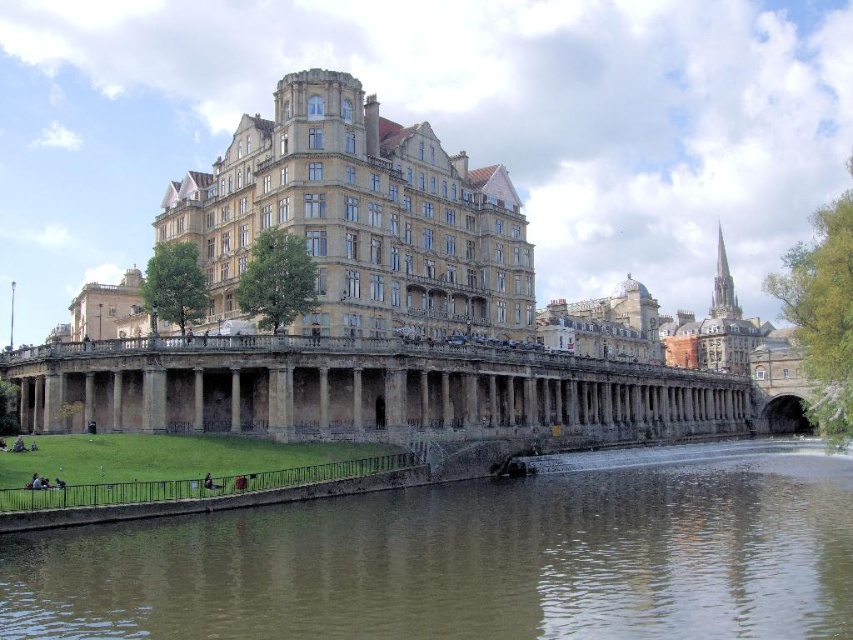
Question: Which of the following is the farthest from the observer?

Choices:
 (A) (244, 561)
 (B) (91, 344)

Answer: (B)

Question: Is brown murky water at lower center below stone columned bridge at center?

Choices:
 (A) no
 (B) yes

Answer: (B)

Question: Does brown murky water at lower center appear on the right side of stone columned bridge at center?

Choices:
 (A) yes
 (B) no

Answer: (A)

Question: Among these objects, which one is nearest to the camera?

Choices:
 (A) brown murky water at lower center
 (B) stone columned bridge at center

Answer: (A)

Question: Is brown murky water at lower center thinner than stone columned bridge at center?

Choices:
 (A) yes
 (B) no

Answer: (A)

Question: Which point appears farthest from the camera in this image?

Choices:
 (A) (346, 572)
 (B) (538, 362)

Answer: (B)